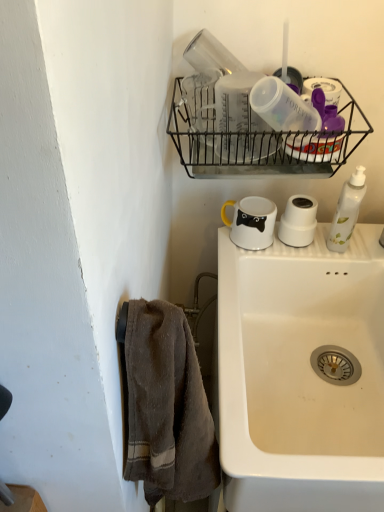
Question: Considering the relative sizes of white glossy mug at upper center and white ceramic sink at lower right in the image provided, is white glossy mug at upper center shorter than white ceramic sink at lower right?

Choices:
 (A) no
 (B) yes

Answer: (B)

Question: Does white glossy mug at upper center appear on the right side of white ceramic sink at lower right?

Choices:
 (A) yes
 (B) no

Answer: (B)

Question: From a real-world perspective, does white glossy mug at upper center sit lower than white ceramic sink at lower right?

Choices:
 (A) yes
 (B) no

Answer: (B)

Question: Can you confirm if white glossy mug at upper center is positioned to the left of white ceramic sink at lower right?

Choices:
 (A) no
 (B) yes

Answer: (B)

Question: Is white glossy mug at upper center aimed at white ceramic sink at lower right?

Choices:
 (A) no
 (B) yes

Answer: (A)

Question: Is white matte toilet paper at upper center bigger or smaller than black wire basket at upper center?

Choices:
 (A) big
 (B) small

Answer: (B)

Question: From the image's perspective, is white matte toilet paper at upper center positioned above or below black wire basket at upper center?

Choices:
 (A) below
 (B) above

Answer: (A)

Question: From a real-world perspective, is white matte toilet paper at upper center positioned above or below black wire basket at upper center?

Choices:
 (A) above
 (B) below

Answer: (B)

Question: Is white matte toilet paper at upper center taller or shorter than black wire basket at upper center?

Choices:
 (A) short
 (B) tall

Answer: (A)

Question: From the image's perspective, is black wire basket at upper center located above or below white glossy mug at upper center?

Choices:
 (A) below
 (B) above

Answer: (B)

Question: Visually, is black wire basket at upper center positioned to the left or to the right of white glossy mug at upper center?

Choices:
 (A) left
 (B) right

Answer: (A)

Question: From a real-world perspective, is black wire basket at upper center positioned above or below white glossy mug at upper center?

Choices:
 (A) above
 (B) below

Answer: (A)

Question: Considering their positions, is black wire basket at upper center located in front of or behind white glossy mug at upper center?

Choices:
 (A) front
 (B) behind

Answer: (A)

Question: Is black wire basket at upper center in front of or behind brown textured towel at left in the image?

Choices:
 (A) front
 (B) behind

Answer: (B)

Question: Is black wire basket at upper center taller or shorter than brown textured towel at left?

Choices:
 (A) short
 (B) tall

Answer: (A)